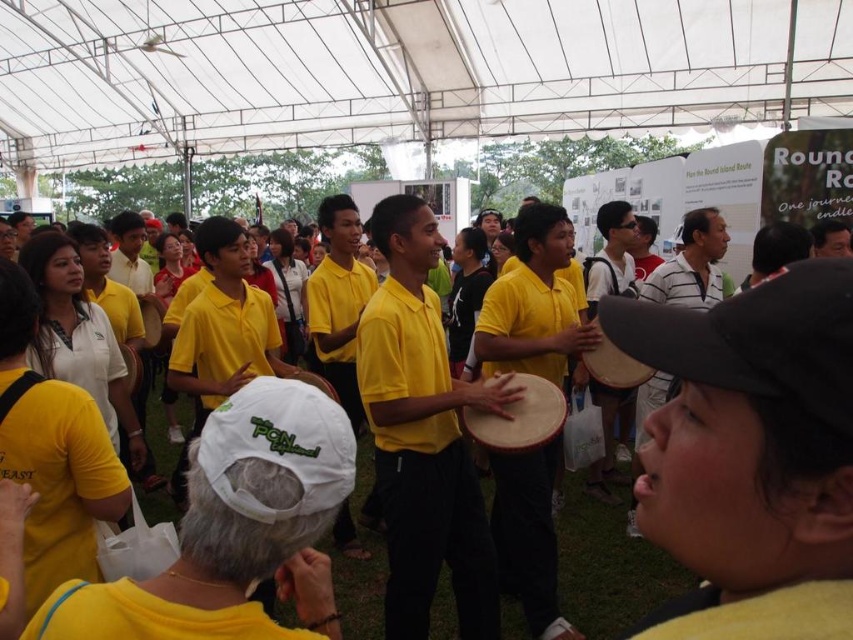
Find the location of a particular element. yellow matte shirt at center is located at coordinates (608, 568).

Is point (158, 513) more distant than point (473, 436)?

Yes, it is behind point (473, 436).

Locate an element on the screen. The image size is (853, 640). yellow matte shirt at center is located at coordinates (608, 568).